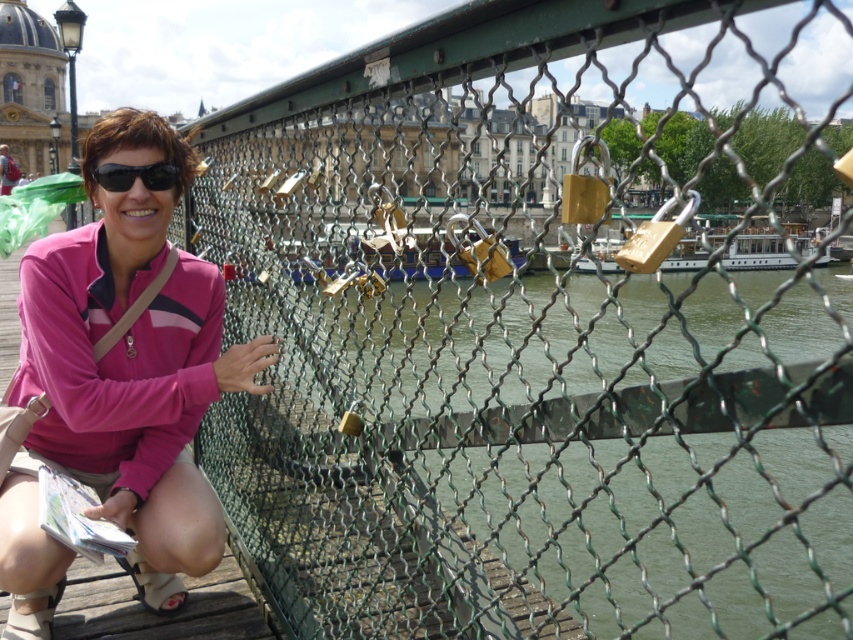
You are a tourist on the bridge and you want to take a photo of the pink fabric at left and the black matte sunglasses at left. Which object should you focus on first if you want to capture both in the same frame without moving the camera?

The pink fabric at left is positioned on the left side of black matte sunglasses at left, so you should focus on the pink fabric at left first to ensure both are in the frame without moving the camera.

You are standing on the bridge and want to take a photo of the pink fabric at left. Where should you position yourself to capture it in the frame?

To capture the pink fabric at left in your photo, position yourself so that the pink fabric at left is centered at coordinates approximately 0.600 on the horizontal axis and 0.142 on the vertical axis.

You are a photographer trying to capture the pink fabric at left and the black matte sunglasses at left in the same frame. Since you want both items to be clearly visible, which object should you focus on to ensure the narrower one is in focus?

The black matte sunglasses at left are narrower than the pink fabric at left, so you should focus on the black matte sunglasses at left to ensure the narrower object is in focus.